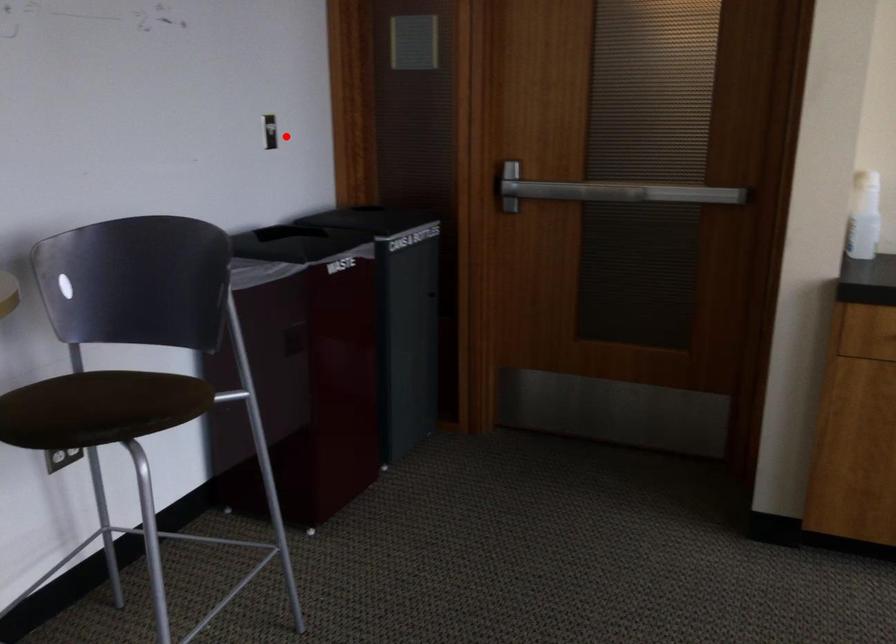
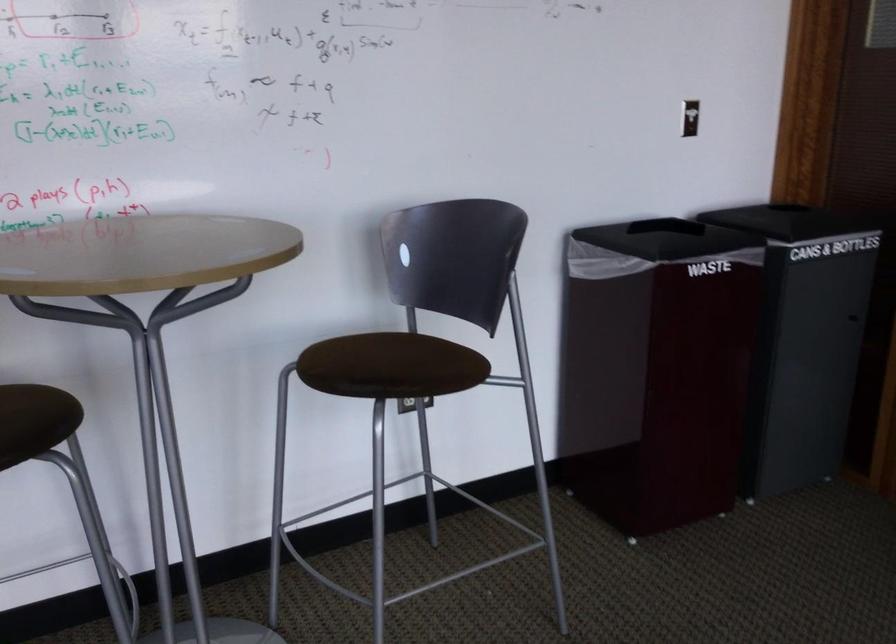
In the second image, find the point that corresponds to the highlighted location in the first image.

(690, 118)